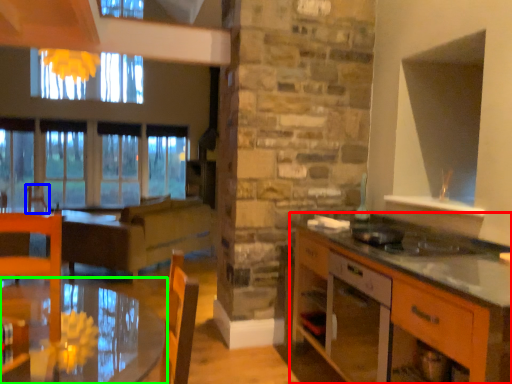
Question: Which is farther away from cabinetry (highlighted by a red box)? armchair (highlighted by a blue box) or table (highlighted by a green box)?

Choices:
 (A) armchair
 (B) table

Answer: (A)